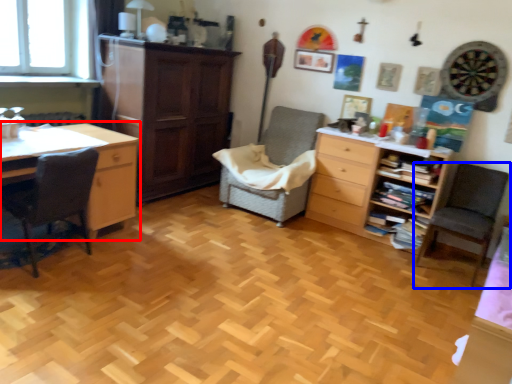
Question: Which object is closer to the camera taking this photo, desk (highlighted by a red box) or chair (highlighted by a blue box)?

Choices:
 (A) desk
 (B) chair

Answer: (A)